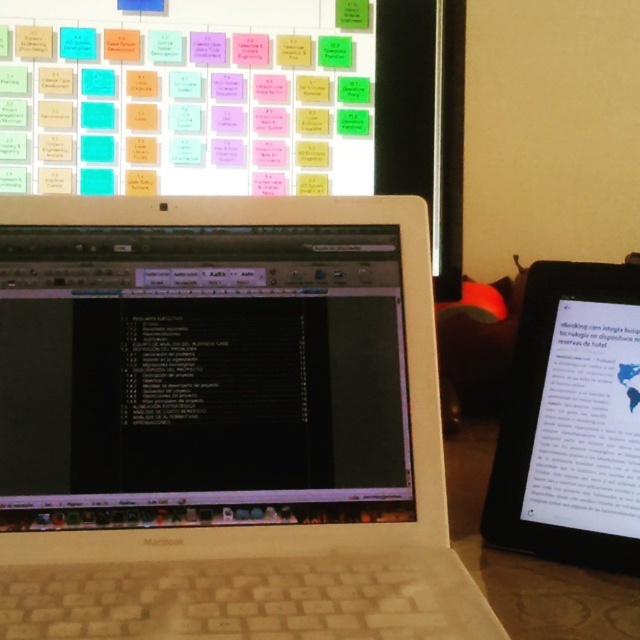
Which is above, white plastic laptop at center or black glossy tablet at right?

white plastic laptop at center is above.

Is white plastic laptop at center wider than black glossy tablet at right?

Correct, the width of white plastic laptop at center exceeds that of black glossy tablet at right.

Does point (369, 211) come closer to viewer compared to point (532, 376)?

Yes, point (369, 211) is in front of point (532, 376).

Locate an element on the screen. The height and width of the screenshot is (640, 640). white plastic laptop at center is located at coordinates (221, 422).